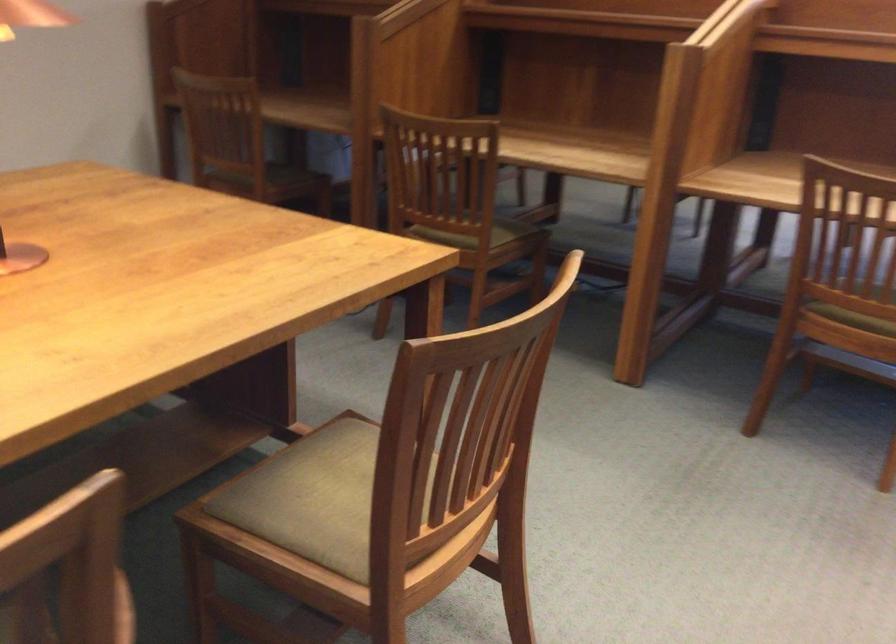
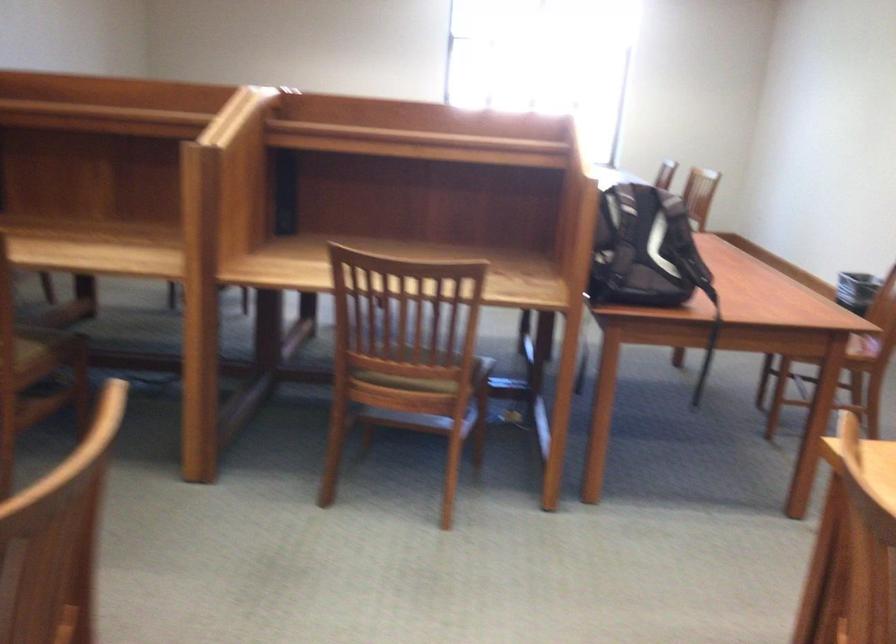
Where in the second image is the point corresponding to point (519, 240) from the first image?

(46, 348)